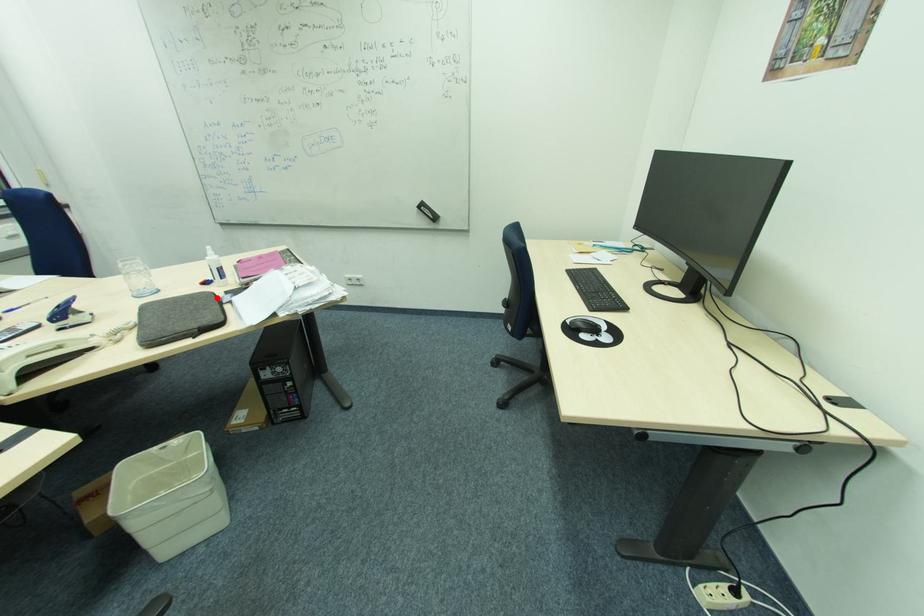
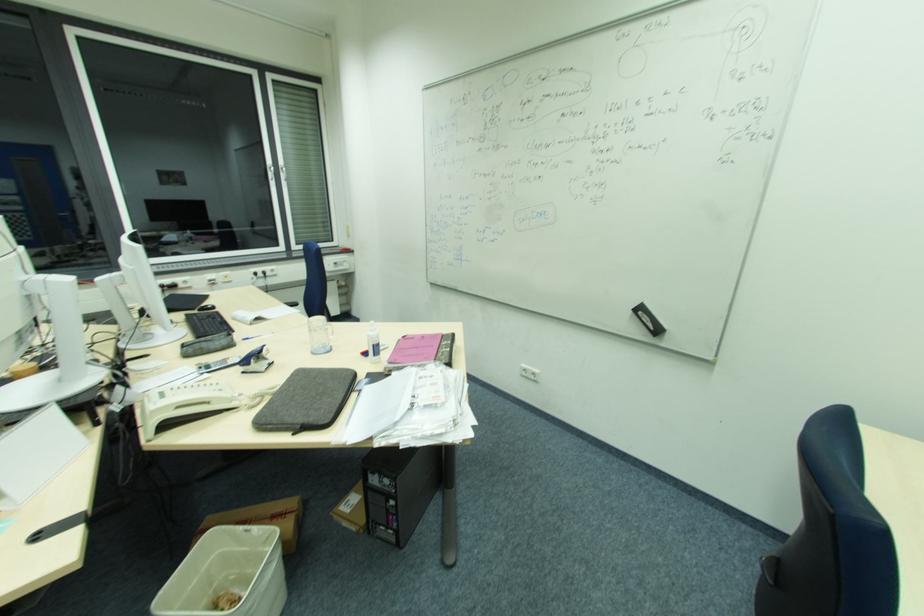
The point at the highlighted location is marked in the first image. Where is the corresponding point in the second image?

(350, 382)